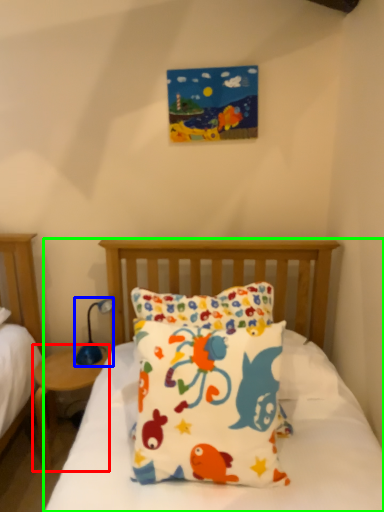
Question: Which object is positioned closest to nightstand (highlighted by a red box)? Select from table lamp (highlighted by a blue box) and bed (highlighted by a green box).

Choices:
 (A) table lamp
 (B) bed

Answer: (A)